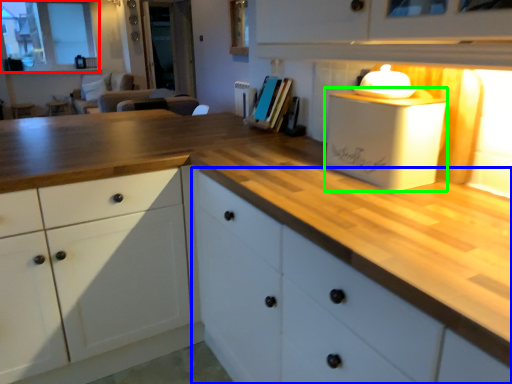
Question: Which object is the farthest from window (highlighted by a red box)? Choose among these: cabinetry (highlighted by a blue box) or appliance (highlighted by a green box).

Choices:
 (A) cabinetry
 (B) appliance

Answer: (B)